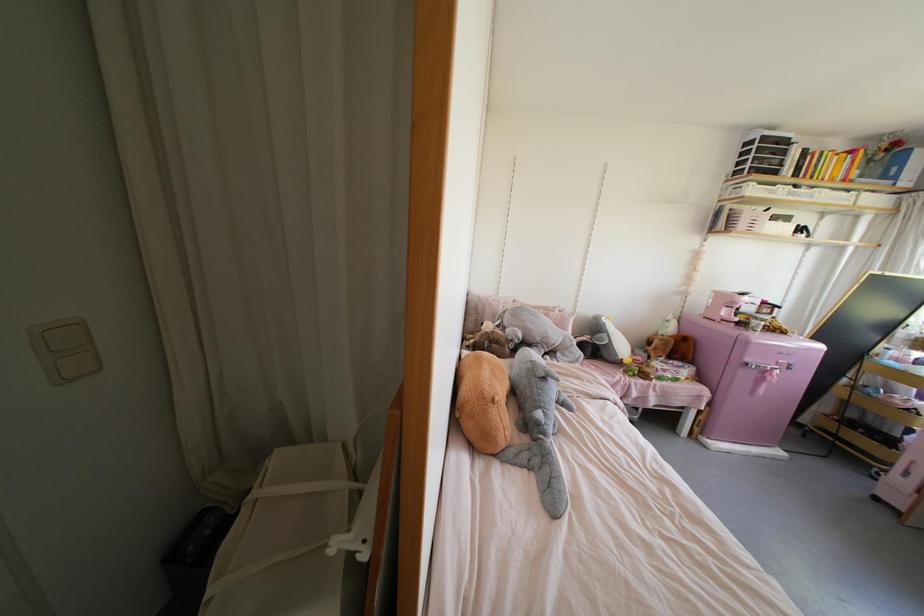
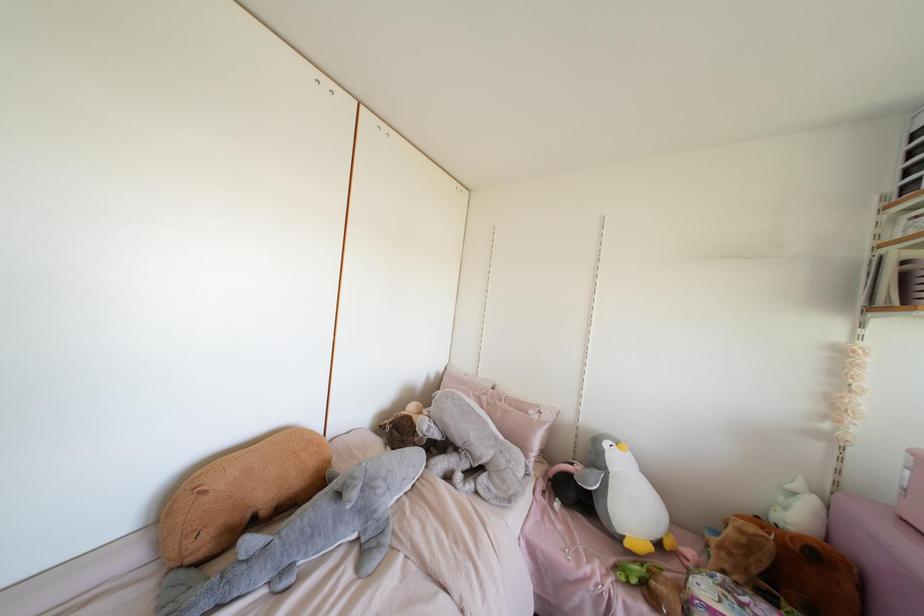
The point at (555, 310) is marked in the first image. Where is the corresponding point in the second image?

(530, 411)